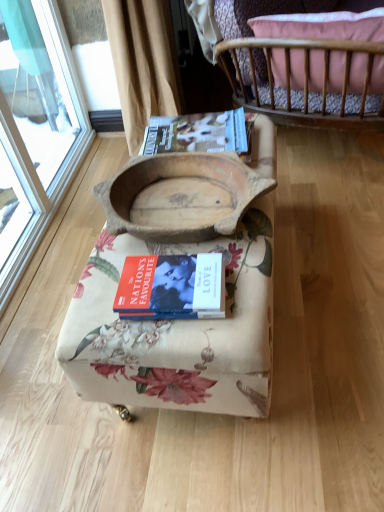
This screenshot has height=512, width=384. Identify the location of blank space above wooden bowl at center, acting as the 1th furniture starting from the bottom (from a real-world perspective). (191, 208).